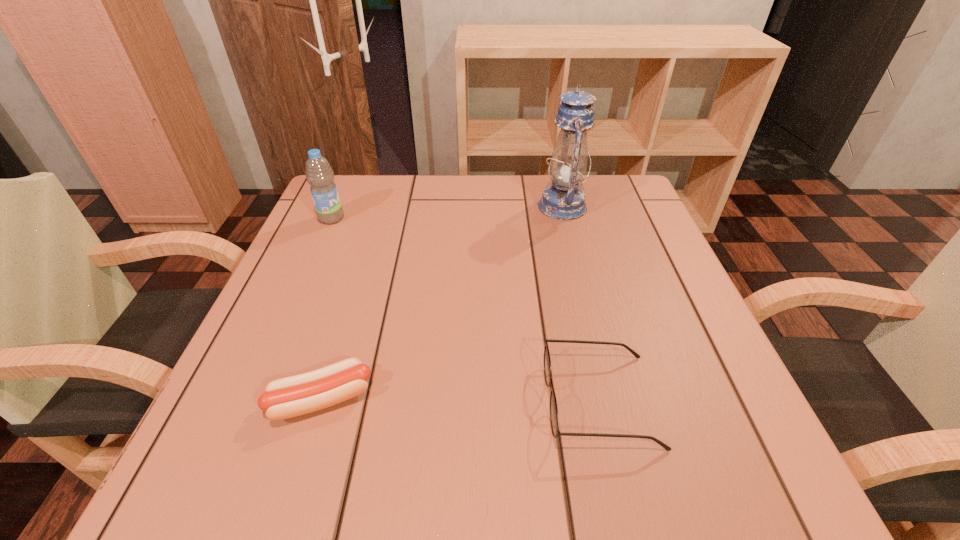
At what (x,y) coordinates should I click in order to perform the action: click on free spot located on the front-facing side of the spectacles. Please return your answer as a coordinate pair (x, y). This screenshot has width=960, height=540. Looking at the image, I should click on (454, 401).

I want to click on free location located 0.080m on the back of the shortest object, so click(342, 334).

You are a GUI agent. You are given a task and a screenshot of the screen. Output one action in this format:
    pyautogui.click(x=<x>, y=<y>)
    Task: Click on the lantern that is at the far edge
    
    Given the screenshot: What is the action you would take?
    pyautogui.click(x=563, y=200)

Where is `water bottle present at the far edge`? The height and width of the screenshot is (540, 960). water bottle present at the far edge is located at coordinates (319, 174).

I want to click on object present at the near edge, so click(x=554, y=418).

Where is `water bottle positioned at the left edge`? water bottle positioned at the left edge is located at coordinates (319, 174).

Identify the location of sausage that is at the left edge. The width and height of the screenshot is (960, 540). (288, 397).

What are the coordinates of `lantern that is at the right edge` in the screenshot? It's located at (563, 200).

This screenshot has height=540, width=960. In order to click on spectacles at the right edge in this screenshot , I will do `click(554, 418)`.

Identify the location of object that is at the far left corner. (319, 174).